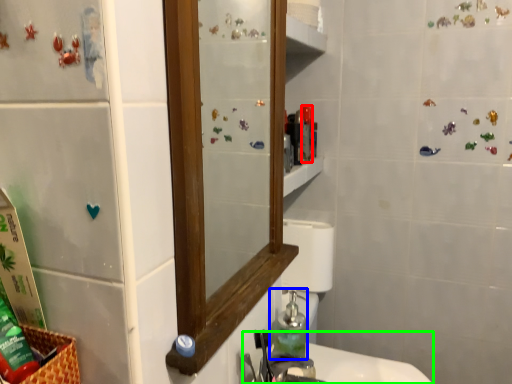
Question: Estimate the real-world distances between objects in this image. Which object is closer to toiletry (highlighted by a red box), soap dispenser (highlighted by a blue box) or sink (highlighted by a green box)?

Choices:
 (A) soap dispenser
 (B) sink

Answer: (A)